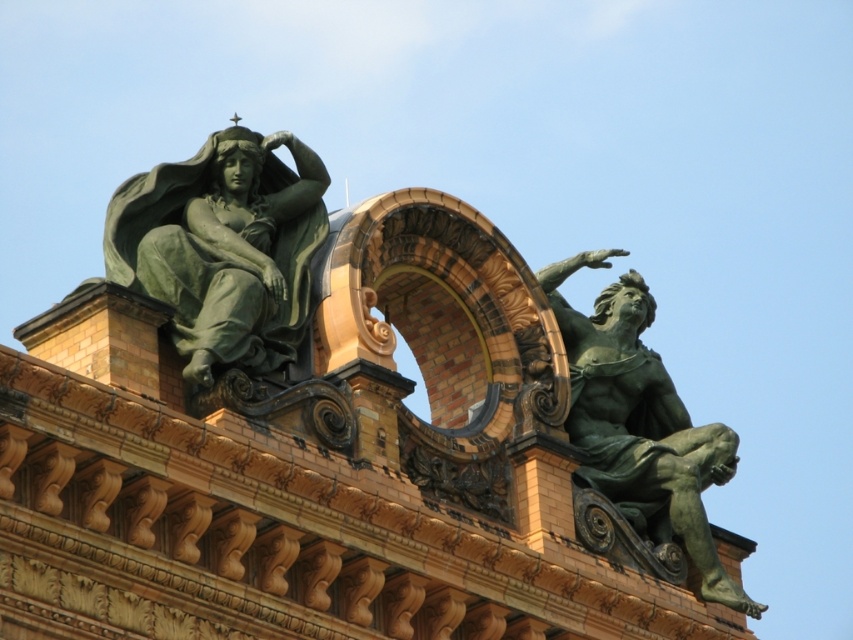
You are an art conservator assessing the placement of two statues on a building facade. The statues are the green patina statue at upper left and the green patina statue at right. Based on their positions, which statue is positioned to the left of the other?

The green patina statue at upper left is positioned to the left of the green patina statue at right.

You are an art conservator assessing the placement of the two green patina statues. From your vantage point, which statue is positioned closer to you, the green patina statue at upper left or the green patina statue at right?

The green patina statue at upper left is closer to the viewer than the green patina statue at right.